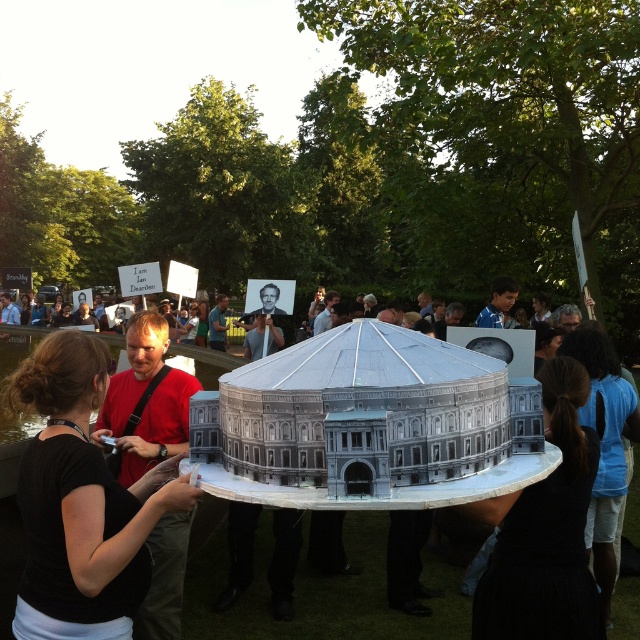
Can you confirm if matte gray building at center is smaller than black fabric ponytail at lower right?

No.

You are a GUI agent. You are given a task and a screenshot of the screen. Output one action in this format:
    pyautogui.click(x=<x>, y=<y>)
    Task: Click on the matte gray building at center
    Image resolution: width=640 pixels, height=640 pixels.
    Given the screenshot: What is the action you would take?
    pyautogui.click(x=314, y=586)

Is black fabric dress at lower right taller than black fabric ponytail at lower right?

Incorrect, black fabric dress at lower right's height is not larger of black fabric ponytail at lower right's.

Who is higher up, black fabric dress at lower right or black fabric ponytail at lower right?

Positioned higher is black fabric dress at lower right.

This screenshot has width=640, height=640. Describe the element at coordinates (545, 531) in the screenshot. I see `black fabric dress at lower right` at that location.

Find the location of a particular element. The width and height of the screenshot is (640, 640). black fabric dress at lower right is located at coordinates (545, 531).

Which is in front, point (99, 512) or point (10, 332)?

Point (99, 512)

Who is lower down, black matte shirt at center or matte gray building at center?

matte gray building at center is lower down.

I want to click on black matte shirt at center, so click(81, 500).